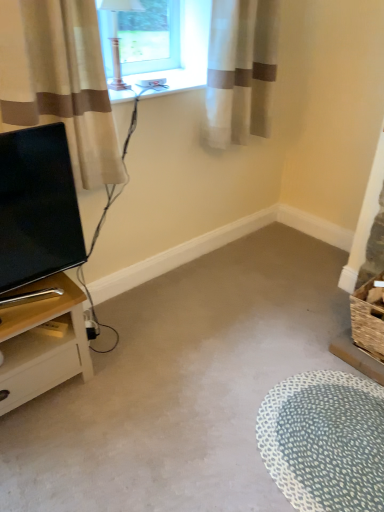
Question: From the image's perspective, is white sheer curtain at upper right, which is counted as the 2th curtain, starting from the front, on top of matte black tv at left?

Choices:
 (A) no
 (B) yes

Answer: (B)

Question: Is white sheer curtain at upper right, the 1th curtain when ordered from right to left, with matte black tv at left?

Choices:
 (A) yes
 (B) no

Answer: (B)

Question: From a real-world perspective, is white sheer curtain at upper right, positioned as the 1th curtain in back-to-front order, under matte black tv at left?

Choices:
 (A) no
 (B) yes

Answer: (A)

Question: Can you confirm if white sheer curtain at upper right, which is counted as the 2th curtain, starting from the front, is taller than matte black tv at left?

Choices:
 (A) no
 (B) yes

Answer: (B)

Question: Can matte black tv at left be found inside white sheer curtain at upper right, the 2th curtain when ordered from left to right?

Choices:
 (A) no
 (B) yes

Answer: (A)

Question: Does white sheer curtain at upper right, which is counted as the 2th curtain, starting from the front, have a greater width compared to matte black tv at left?

Choices:
 (A) yes
 (B) no

Answer: (A)

Question: Is the depth of beige fabric curtain at left, the first curtain positioned from the front, greater than that of carpet at center?

Choices:
 (A) no
 (B) yes

Answer: (B)

Question: Does beige fabric curtain at left, the first curtain positioned from the front, have a greater width compared to carpet at center?

Choices:
 (A) no
 (B) yes

Answer: (A)

Question: Can you confirm if beige fabric curtain at left, the first curtain from the left, is taller than carpet at center?

Choices:
 (A) yes
 (B) no

Answer: (A)

Question: Does beige fabric curtain at left, which appears as the 2th curtain when viewed from the right, lie in front of carpet at center?

Choices:
 (A) yes
 (B) no

Answer: (B)

Question: Is beige fabric curtain at left, the first curtain positioned from the front, oriented towards carpet at center?

Choices:
 (A) no
 (B) yes

Answer: (A)

Question: From a real-world perspective, is beige fabric curtain at left, the first curtain from the left, over carpet at center?

Choices:
 (A) yes
 (B) no

Answer: (A)

Question: Is matte black tv at left at the left side of white dotted rug at lower right?

Choices:
 (A) no
 (B) yes

Answer: (B)